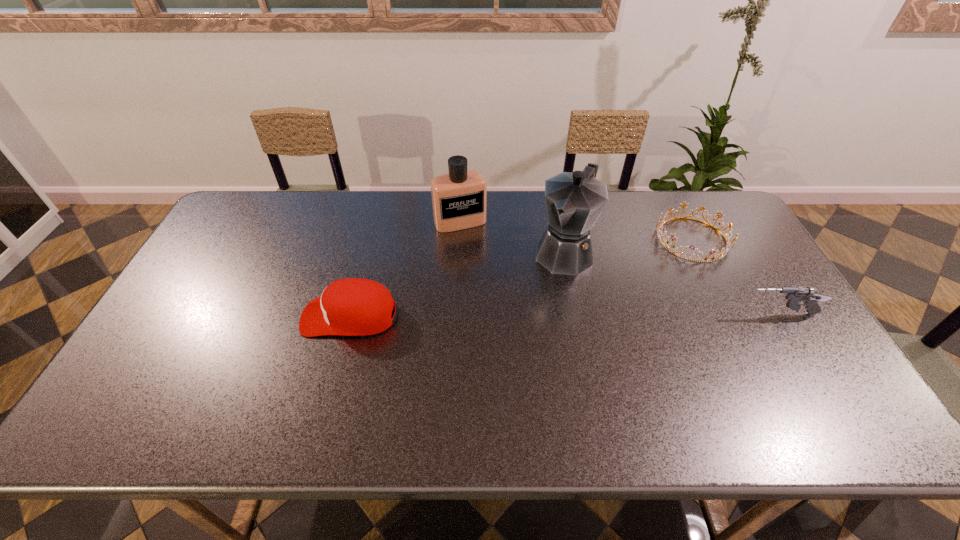
Identify the location of baseball cap. This screenshot has width=960, height=540. (352, 306).

I want to click on gun, so click(795, 295).

In order to click on tiara in this screenshot , I will do `click(724, 250)`.

Identify the location of perfume. (459, 198).

The height and width of the screenshot is (540, 960). Identify the location of the second tallest object. (459, 198).

Find the location of a particular element. This screenshot has height=540, width=960. the tallest object is located at coordinates (574, 201).

The image size is (960, 540). In order to click on coffeepot in this screenshot , I will do `click(574, 201)`.

This screenshot has height=540, width=960. Identify the location of vacant area situated on the front-facing side of the leftmost object. (266, 316).

Where is `free space located 0.310m on the front-facing side of the leftmost object`? free space located 0.310m on the front-facing side of the leftmost object is located at coordinates (189, 316).

The image size is (960, 540). Identify the location of blank space located 0.380m on the front-facing side of the leftmost object. (163, 316).